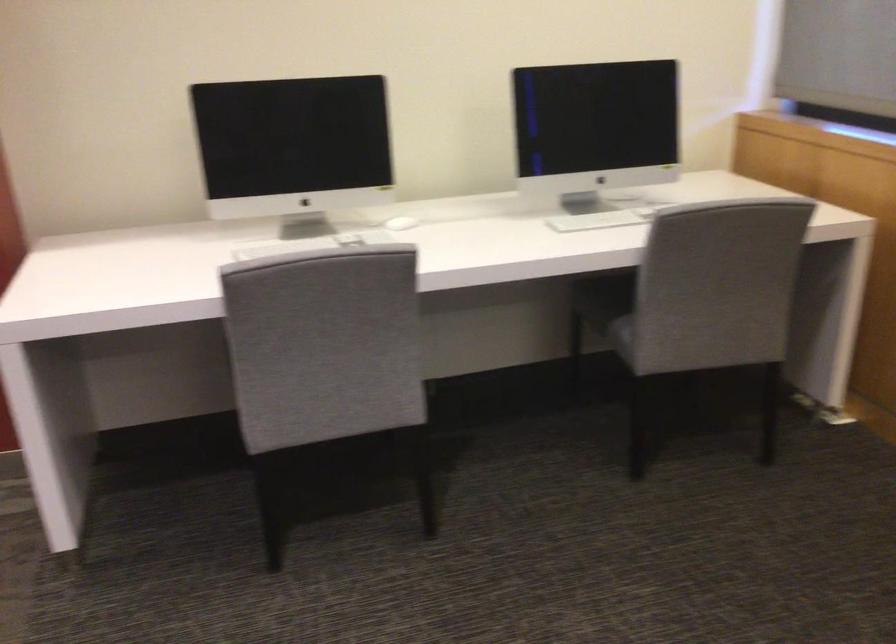
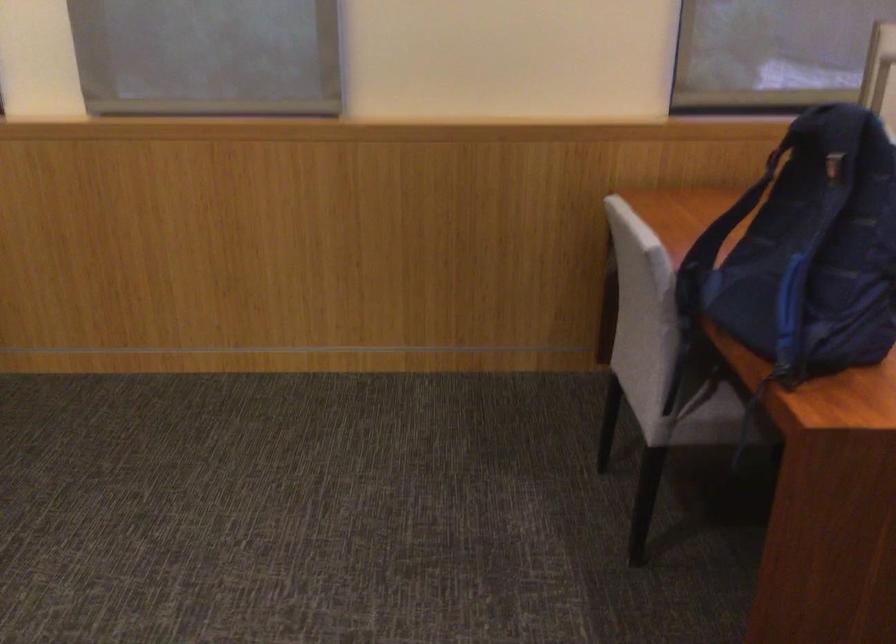
Question: The images are taken continuously from a first-person perspective. In which direction is your viewpoint rotating?

Choices:
 (A) Left
 (B) Right
 (C) Up
 (D) Down

Answer: (B)